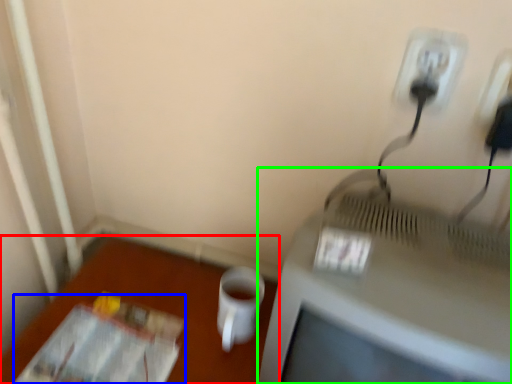
Question: Considering the real-world distances, which object is farthest from table (highlighted by a red box)? magazine (highlighted by a blue box) or television (highlighted by a green box)?

Choices:
 (A) magazine
 (B) television

Answer: (B)